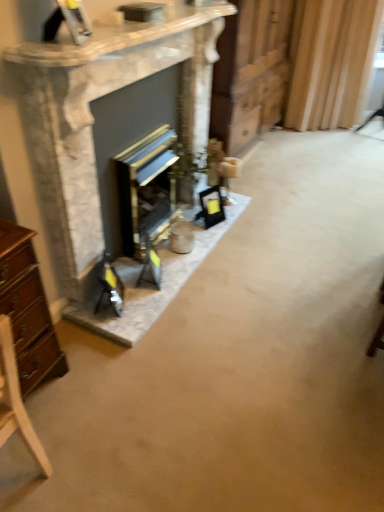
Question: From the image's perspective, does wooden at center appear higher than marble fireplace at center?

Choices:
 (A) no
 (B) yes

Answer: (B)

Question: Considering the relative sizes of wooden at center and marble fireplace at center in the image provided, is wooden at center taller than marble fireplace at center?

Choices:
 (A) yes
 (B) no

Answer: (A)

Question: Can you confirm if wooden at center is wider than marble fireplace at center?

Choices:
 (A) no
 (B) yes

Answer: (B)

Question: Does wooden at center touch marble fireplace at center?

Choices:
 (A) no
 (B) yes

Answer: (A)

Question: Could you tell me if wooden at center is turned towards marble fireplace at center?

Choices:
 (A) no
 (B) yes

Answer: (A)

Question: Would you say marble fireplace at center is inside or outside wooden at center?

Choices:
 (A) inside
 (B) outside

Answer: (B)

Question: Relative to wooden at center, is marble fireplace at center in front or behind?

Choices:
 (A) behind
 (B) front

Answer: (B)

Question: Is point (144, 41) positioned closer to the camera than point (248, 81)?

Choices:
 (A) closer
 (B) farther

Answer: (A)

Question: From the image's perspective, is marble fireplace at center above or below wooden at center?

Choices:
 (A) below
 (B) above

Answer: (A)

Question: Considering the positions of point (140, 157) and point (355, 29), is point (140, 157) closer or farther from the camera than point (355, 29)?

Choices:
 (A) farther
 (B) closer

Answer: (B)

Question: Considering the positions of gold metallic wood burning stove at center and wooden curtain at right in the image, is gold metallic wood burning stove at center wider or thinner than wooden curtain at right?

Choices:
 (A) wide
 (B) thin

Answer: (B)

Question: Looking at the image, does gold metallic wood burning stove at center seem bigger or smaller compared to wooden curtain at right?

Choices:
 (A) big
 (B) small

Answer: (B)

Question: From a real-world perspective, is gold metallic wood burning stove at center above or below wooden curtain at right?

Choices:
 (A) below
 (B) above

Answer: (A)

Question: Is point (145, 25) positioned closer to the camera than point (33, 430)?

Choices:
 (A) closer
 (B) farther

Answer: (B)

Question: Is marble fireplace at center inside or outside of light wood chair at lower left?

Choices:
 (A) outside
 (B) inside

Answer: (A)